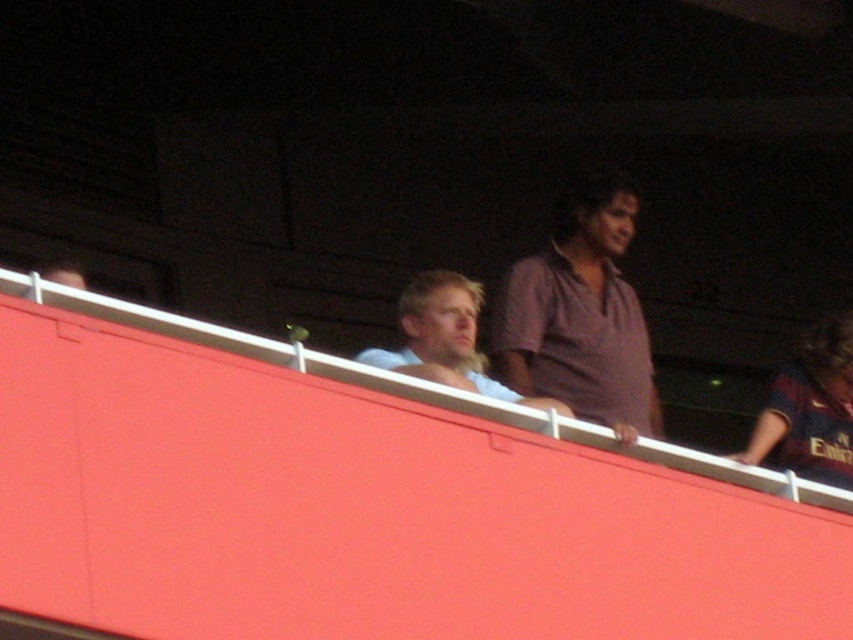
Is point (505, 308) positioned in front of point (456, 330)?

No, (505, 308) is further to viewer.

Based on the photo, who is taller, purple cotton shirt at upper right or light blue shirt at center?

With more height is purple cotton shirt at upper right.

Identify the location of purple cotton shirt at upper right. Image resolution: width=853 pixels, height=640 pixels. (579, 314).

Locate an element on the screen. The width and height of the screenshot is (853, 640). purple cotton shirt at upper right is located at coordinates (579, 314).

Can you confirm if matte jersey at upper right is thinner than light blue shirt at center?

No, matte jersey at upper right is not thinner than light blue shirt at center.

Can you confirm if matte jersey at upper right is positioned below light blue shirt at center?

Yes.

What do you see at coordinates (810, 410) in the screenshot? I see `matte jersey at upper right` at bounding box center [810, 410].

Where is `matte jersey at upper right`? matte jersey at upper right is located at coordinates (810, 410).

Can you confirm if purple cotton shirt at upper right is wider than matte jersey at upper right?

Incorrect, purple cotton shirt at upper right's width does not surpass matte jersey at upper right's.

Can you confirm if purple cotton shirt at upper right is positioned to the left of matte jersey at upper right?

Yes, purple cotton shirt at upper right is to the left of matte jersey at upper right.

Where is `purple cotton shirt at upper right`? The image size is (853, 640). purple cotton shirt at upper right is located at coordinates (579, 314).